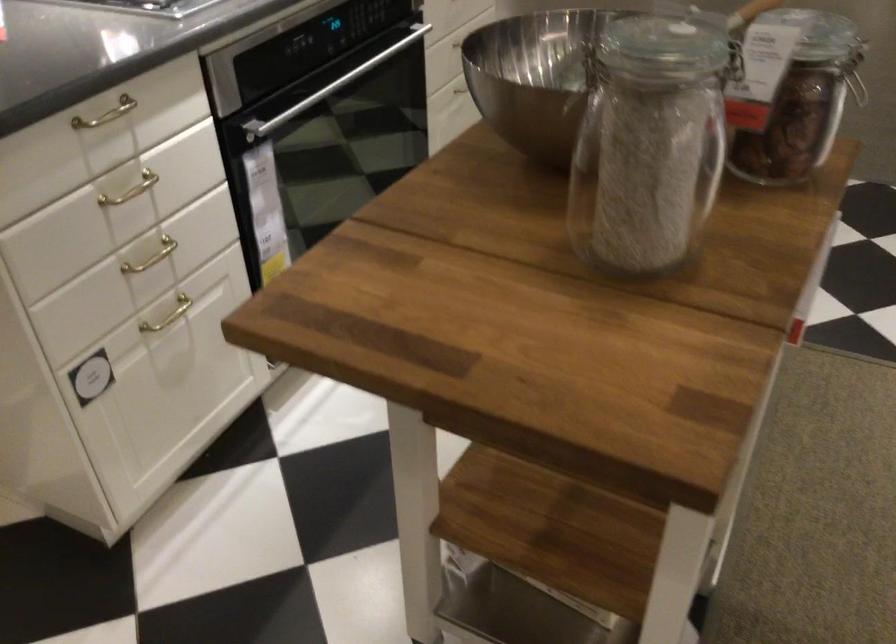
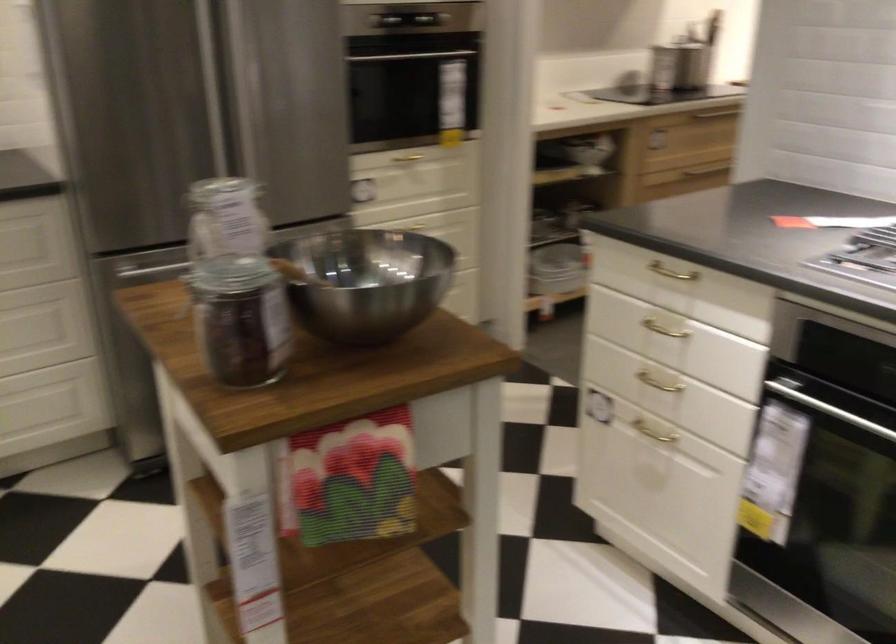
In the second image, find the point that corresponds to (307,102) in the first image.

(826, 408)